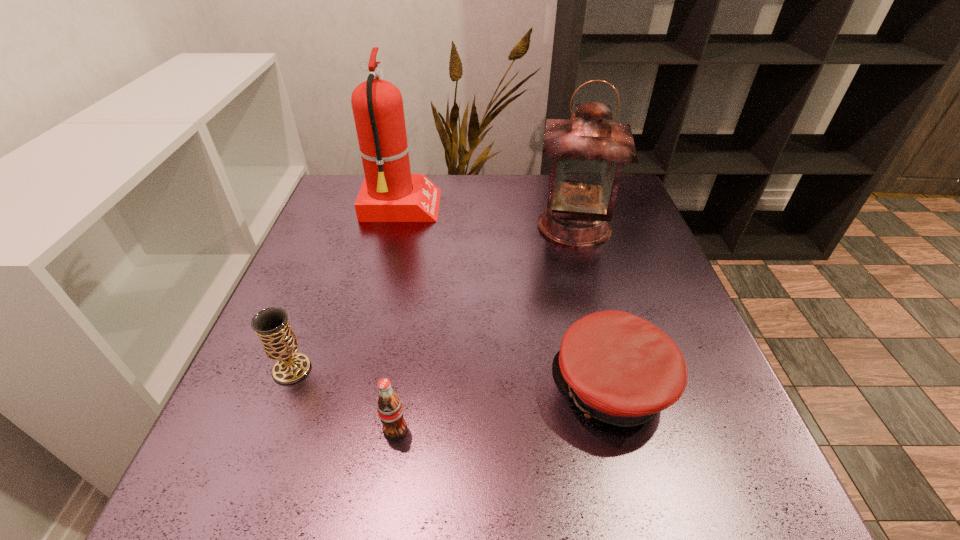
Identify the location of fire extinguisher. (390, 193).

You are a GUI agent. You are given a task and a screenshot of the screen. Output one action in this format:
    pyautogui.click(x=<x>, y=<y>)
    Task: Click on the oil lamp
    
    Given the screenshot: What is the action you would take?
    pyautogui.click(x=588, y=152)

This screenshot has width=960, height=540. In order to click on chalice in this screenshot , I will do `click(279, 342)`.

I want to click on soda, so click(x=389, y=406).

Image resolution: width=960 pixels, height=540 pixels. I want to click on the shortest object, so click(618, 368).

Find the location of a particular element. This screenshot has height=540, width=960. vacant space located 0.180m on the front-facing side of the fire extinguisher is located at coordinates click(x=505, y=207).

I want to click on free space located on the left of the oil lamp, so click(x=425, y=226).

This screenshot has width=960, height=540. I want to click on vacant space located on the back of the chalice, so click(x=328, y=274).

What are the coordinates of `vacant space situated 0.190m on the back of the soda` in the screenshot? It's located at (410, 332).

Where is `free space located 0.120m on the front-facing side of the shortest object`? The image size is (960, 540). free space located 0.120m on the front-facing side of the shortest object is located at coordinates (486, 388).